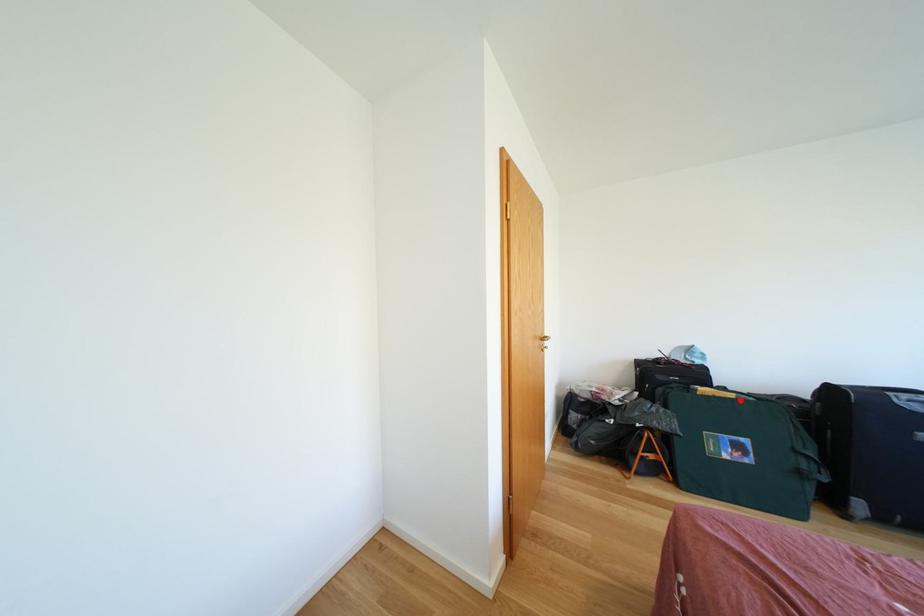
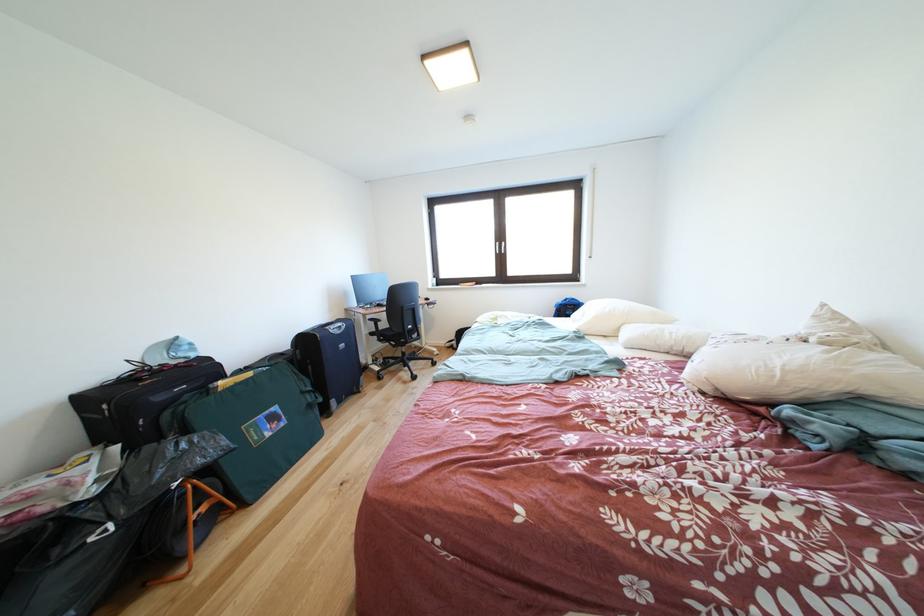
The point at the highlighted location is marked in the first image. Where is the corresponding point in the second image?

(259, 379)